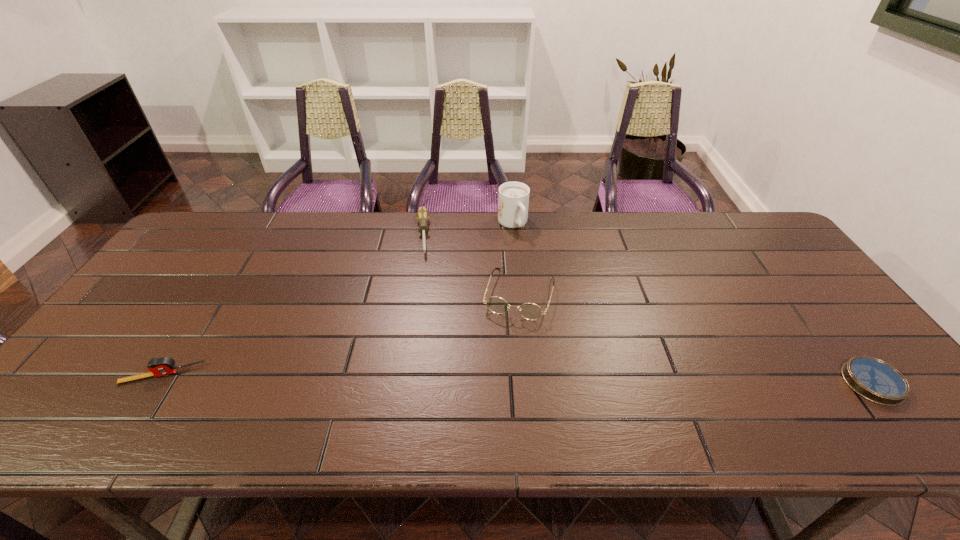
Image resolution: width=960 pixels, height=540 pixels. Find the location of `the second closest object to the second tallest object`. the second closest object to the second tallest object is located at coordinates (422, 215).

The width and height of the screenshot is (960, 540). In order to click on the closest object relative to the shortest object in this screenshot , I will do pos(530,311).

Where is `free space that satisfies the following two spatial constraints: 1. on the front side of the third nearest object; 2. on the left side of the compass`? This screenshot has height=540, width=960. free space that satisfies the following two spatial constraints: 1. on the front side of the third nearest object; 2. on the left side of the compass is located at coordinates (527, 382).